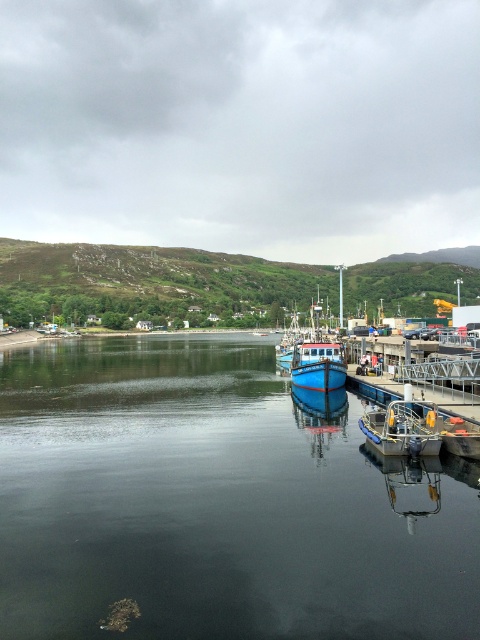
Measure the distance between metallic blue boat at center and blue matte boat at center.

65.89 feet

Does metallic blue boat at center appear on the right side of blue matte boat at center?

Indeed, metallic blue boat at center is positioned on the right side of blue matte boat at center.

Between point (414, 426) and point (333, 353), which one is positioned behind?

Positioned behind is point (333, 353).

Where is `metallic blue boat at center`? The width and height of the screenshot is (480, 640). metallic blue boat at center is located at coordinates (402, 429).

This screenshot has width=480, height=640. I want to click on smooth dark water at center, so click(x=216, y=502).

Who is shorter, smooth dark water at center or metallic blue boat at center?

metallic blue boat at center

Is point (52, 381) positioned behind point (398, 428)?

That is True.

Identify the location of smooth dark water at center. (216, 502).

Does smooth dark water at center appear on the left side of blue matte boat at center?

Correct, you'll find smooth dark water at center to the left of blue matte boat at center.

Is smooth dark water at center positioned at the back of blue matte boat at center?

That is False.

Is point (225, 637) positioned behind point (304, 362)?

No, (225, 637) is closer to viewer.

You are a GUI agent. You are given a task and a screenshot of the screen. Output one action in this format:
    pyautogui.click(x=<x>, y=<y>)
    Task: Click on the smooth dark water at center
    
    Given the screenshot: What is the action you would take?
    pyautogui.click(x=216, y=502)